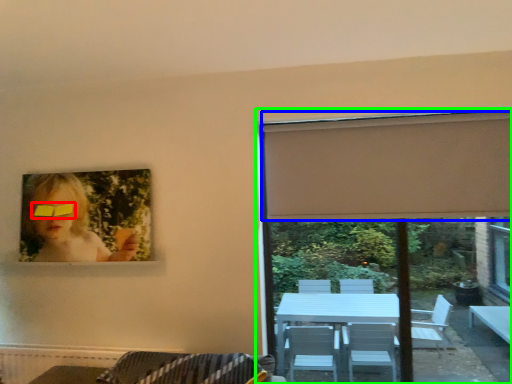
Question: Based on their relative distances, which object is nearer to glasses (highlighted by a red box)? Choose from curtain (highlighted by a blue box) and window (highlighted by a green box).

Choices:
 (A) curtain
 (B) window

Answer: (B)